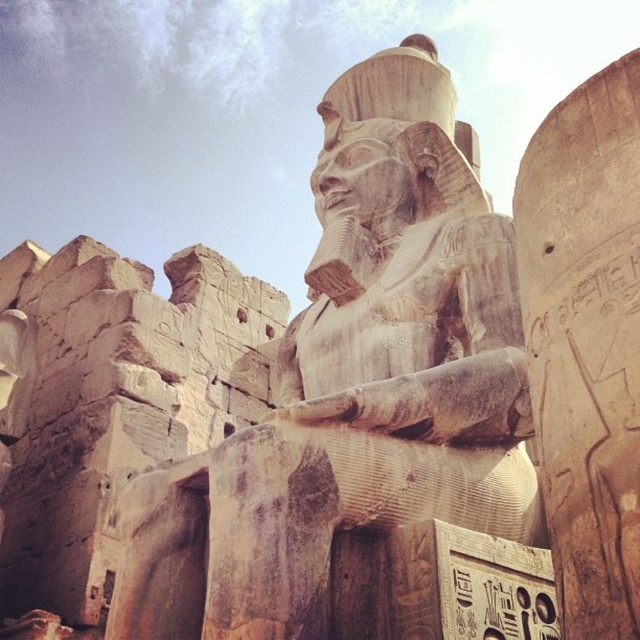
You are an archaeologist standing in front of the ancient Egyptian temple scene. You notice the carved stone statue at center. Based on its coordinates at point 0.605, 0.555, can you determine if it is positioned closer to the left or right side of the image?

The carved stone statue at center is located at coordinates 0.605 on the x and 0.555 on the y. Since the x value is 0.605, which is closer to 1.0 than 0.0, the statue is positioned closer to the right side of the image.

You are an archaeologist examining the ancient Egyptian temple ruins. You notice two points marked on your map at coordinates point (426, 404) and point (616, 321). Which point is closer to you when standing at the entrance of the temple?

Point (616, 321) is closer to you because it is in front of point (426, 404), which is behind it.

You are an archaeologist examining the monumental ancient statue in the image. You notice a specific point marked at coordinates (x=355, y=387). Based on your knowledge of the statue and its carvings, where is this point located?

The point at (x=355, y=387) is on the carved stone statue at center.